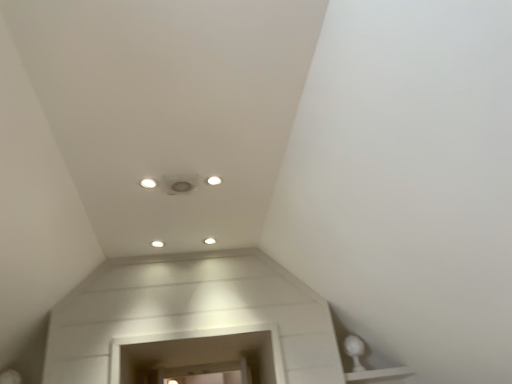
Where is `white glossy light fixture at center, arranged as the 2th dot when viewed from the top`? This screenshot has width=512, height=384. white glossy light fixture at center, arranged as the 2th dot when viewed from the top is located at coordinates (209, 241).

What do you see at coordinates (209, 241) in the screenshot? I see `white glossy light fixture at center, positioned as the second dot in left-to-right order` at bounding box center [209, 241].

Image resolution: width=512 pixels, height=384 pixels. What do you see at coordinates (148, 183) in the screenshot?
I see `white glossy light fixture at upper center, marked as the 1th dot in a top-to-bottom arrangement` at bounding box center [148, 183].

Identify the location of white glossy light fixture at upper center, the second dot in the back-to-front sequence. The image size is (512, 384). (148, 183).

At what (x,y) coordinates should I click in order to perform the action: click on white glossy light fixture at center, which appears as the first dot when ordered from the bottom. Please return your answer as a coordinate pair (x, y). This screenshot has height=384, width=512. Looking at the image, I should click on (209, 241).

Based on their positions, is white glossy light fixture at upper center, the second dot in the back-to-front sequence, located to the left or right of white glossy light fixture at center, the 1th dot positioned from the back?

white glossy light fixture at upper center, the second dot in the back-to-front sequence, is to the left of white glossy light fixture at center, the 1th dot positioned from the back.

Between white glossy light fixture at upper center, which is the 1th dot in left-to-right order, and white glossy light fixture at center, positioned as the second dot in left-to-right order, which one is positioned in front?

Positioned in front is white glossy light fixture at upper center, which is the 1th dot in left-to-right order.

Does point (145, 180) come closer to viewer compared to point (208, 241)?

Yes.

From the image's perspective, would you say white glossy light fixture at upper center, marked as the 1th dot in a top-to-bottom arrangement, is positioned over white glossy light fixture at center, which appears as the 1th dot when viewed from the right?

Yes, from the image's perspective, white glossy light fixture at upper center, marked as the 1th dot in a top-to-bottom arrangement, is over white glossy light fixture at center, which appears as the 1th dot when viewed from the right.

From a real-world perspective, who is located lower, white glossy light fixture at upper center, the 2th dot viewed from the right, or white glossy light fixture at center, the 1th dot positioned from the back?

From a 3D spatial view, white glossy light fixture at center, the 1th dot positioned from the back, is below.

Looking at their sizes, would you say white glossy light fixture at upper center, placed as the 2th dot when sorted from bottom to top, is wider or thinner than white glossy light fixture at center, which appears as the first dot when ordered from the bottom?

In the image, white glossy light fixture at upper center, placed as the 2th dot when sorted from bottom to top, appears to be more narrow than white glossy light fixture at center, which appears as the first dot when ordered from the bottom.

Consider the image. Which of these two, white glossy light fixture at upper center, the second dot in the back-to-front sequence, or white glossy light fixture at center, which appears as the first dot when ordered from the bottom, stands shorter?

white glossy light fixture at upper center, the second dot in the back-to-front sequence, is shorter.

Between white glossy light fixture at upper center, which is the 1th dot in left-to-right order, and white glossy light fixture at center, which is the 2th dot from front to back, which one has smaller size?

white glossy light fixture at upper center, which is the 1th dot in left-to-right order.

Is white glossy light fixture at upper center, the 2th dot viewed from the right, situated inside white glossy light fixture at center, which appears as the 1th dot when viewed from the right, or outside?

white glossy light fixture at upper center, the 2th dot viewed from the right, lies outside white glossy light fixture at center, which appears as the 1th dot when viewed from the right.

Is white glossy light fixture at upper center, placed as the 2th dot when sorted from bottom to top, next to white glossy light fixture at center, the 1th dot positioned from the back?

No, white glossy light fixture at upper center, placed as the 2th dot when sorted from bottom to top, is not touching white glossy light fixture at center, the 1th dot positioned from the back.

Is white glossy light fixture at upper center, marked as the 1th dot in a top-to-bottom arrangement, turned away from white glossy light fixture at center, which appears as the first dot when ordered from the bottom?

That's right, white glossy light fixture at upper center, marked as the 1th dot in a top-to-bottom arrangement, is facing away from white glossy light fixture at center, which appears as the first dot when ordered from the bottom.

Measure the distance from white glossy light fixture at upper center, marked as the 1th dot in a top-to-bottom arrangement, to white glossy light fixture at center, the 1th dot positioned from the back.

white glossy light fixture at upper center, marked as the 1th dot in a top-to-bottom arrangement, is 75.21 centimeters away from white glossy light fixture at center, the 1th dot positioned from the back.

Where is `dot on the right of white glossy light fixture at upper center, the 2th dot viewed from the right`? This screenshot has height=384, width=512. dot on the right of white glossy light fixture at upper center, the 2th dot viewed from the right is located at coordinates (209, 241).

From the picture: Can you confirm if white glossy light fixture at center, positioned as the second dot in left-to-right order, is positioned to the right of white glossy light fixture at upper center, which is the 1th dot in left-to-right order?

Yes.

Which object is further away from the camera taking this photo, white glossy light fixture at center, positioned as the second dot in left-to-right order, or white glossy light fixture at upper center, the 2th dot viewed from the right?

white glossy light fixture at center, positioned as the second dot in left-to-right order, is more distant.

Does point (211, 239) come closer to viewer compared to point (144, 186)?

No, (211, 239) is behind (144, 186).

Looking at this image, from the image's perspective, is white glossy light fixture at center, which appears as the first dot when ordered from the bottom, located above or below white glossy light fixture at upper center, the first dot when ordered from front to back?

From the image's perspective, white glossy light fixture at center, which appears as the first dot when ordered from the bottom, appears below white glossy light fixture at upper center, the first dot when ordered from front to back.

From a real-world perspective, relative to white glossy light fixture at upper center, the 2th dot viewed from the right, is white glossy light fixture at center, which appears as the first dot when ordered from the bottom, vertically above or below?

Clearly, from a real-world perspective, white glossy light fixture at center, which appears as the first dot when ordered from the bottom, is below white glossy light fixture at upper center, the 2th dot viewed from the right.

Which of these two, white glossy light fixture at center, which appears as the first dot when ordered from the bottom, or white glossy light fixture at upper center, the 2th dot viewed from the right, is thinner?

white glossy light fixture at upper center, the 2th dot viewed from the right, is thinner.

Is white glossy light fixture at center, the 1th dot positioned from the back, taller or shorter than white glossy light fixture at upper center, marked as the 1th dot in a top-to-bottom arrangement?

white glossy light fixture at center, the 1th dot positioned from the back, is taller than white glossy light fixture at upper center, marked as the 1th dot in a top-to-bottom arrangement.

Looking at the image, does white glossy light fixture at center, which appears as the 1th dot when viewed from the right, seem bigger or smaller compared to white glossy light fixture at upper center, placed as the 2th dot when sorted from bottom to top?

In the image, white glossy light fixture at center, which appears as the 1th dot when viewed from the right, appears to be larger than white glossy light fixture at upper center, placed as the 2th dot when sorted from bottom to top.

Is white glossy light fixture at center, which appears as the 1th dot when viewed from the right, outside of white glossy light fixture at upper center, the first dot when ordered from front to back?

Yes, white glossy light fixture at center, which appears as the 1th dot when viewed from the right, is not within white glossy light fixture at upper center, the first dot when ordered from front to back.

Is white glossy light fixture at center, arranged as the 2th dot when viewed from the top, far away from white glossy light fixture at upper center, marked as the 1th dot in a top-to-bottom arrangement?

No, there isn't a large distance between white glossy light fixture at center, arranged as the 2th dot when viewed from the top, and white glossy light fixture at upper center, marked as the 1th dot in a top-to-bottom arrangement.

Is white glossy light fixture at center, arranged as the 2th dot when viewed from the top, positioned with its back to white glossy light fixture at upper center, placed as the 2th dot when sorted from bottom to top?

No, white glossy light fixture at center, arranged as the 2th dot when viewed from the top, is not facing away from white glossy light fixture at upper center, placed as the 2th dot when sorted from bottom to top.

Locate an element on the screen. dot above the white glossy light fixture at center, positioned as the second dot in left-to-right order (from the image's perspective) is located at coordinates (148, 183).

Locate an element on the screen. Image resolution: width=512 pixels, height=384 pixels. dot below the white glossy light fixture at upper center, the second dot in the back-to-front sequence (from the image's perspective) is located at coordinates (209, 241).

This screenshot has height=384, width=512. I want to click on dot above the white glossy light fixture at center, arranged as the 2th dot when viewed from the top (from a real-world perspective), so pos(148,183).